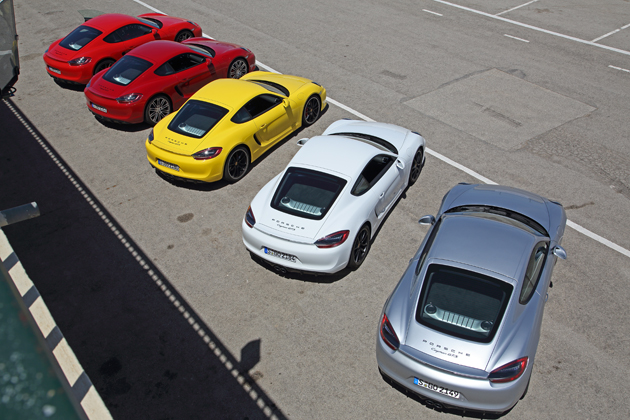
Locate an element on the screen. side windows is located at coordinates (121, 34), (184, 63), (258, 107), (370, 167), (530, 276), (428, 240).